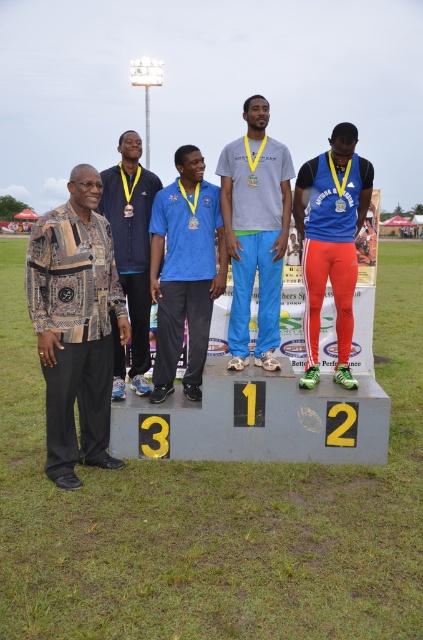
In the scene shown: Who is higher up, gray matte t-shirt at center or matte blue shirt at center?

gray matte t-shirt at center is above.

Which is behind, point (250, 131) or point (178, 259)?

Positioned behind is point (250, 131).

The image size is (423, 640). What are the coordinates of `gray matte t-shirt at center` in the screenshot? It's located at (255, 230).

Can you confirm if patterned fabric jacket at left is positioned to the left of blue synthetic track suit at center?

Indeed, patterned fabric jacket at left is positioned on the left side of blue synthetic track suit at center.

Does patterned fabric jacket at left have a greater height compared to blue synthetic track suit at center?

Correct, patterned fabric jacket at left is much taller as blue synthetic track suit at center.

Where is `patterned fabric jacket at left`? patterned fabric jacket at left is located at coordinates (74, 324).

Locate an element on the screen. The width and height of the screenshot is (423, 640). patterned fabric jacket at left is located at coordinates (74, 324).

Does point (98, 259) come in front of point (252, 192)?

Yes, point (98, 259) is in front of point (252, 192).

From the picture: Between patterned fabric jacket at left and gray matte t-shirt at center, which one is positioned lower?

patterned fabric jacket at left is below.

You are a GUI agent. You are given a task and a screenshot of the screen. Output one action in this format:
    pyautogui.click(x=<x>, y=<y>)
    Task: Click on the patterned fabric jacket at left
    
    Given the screenshot: What is the action you would take?
    pyautogui.click(x=74, y=324)